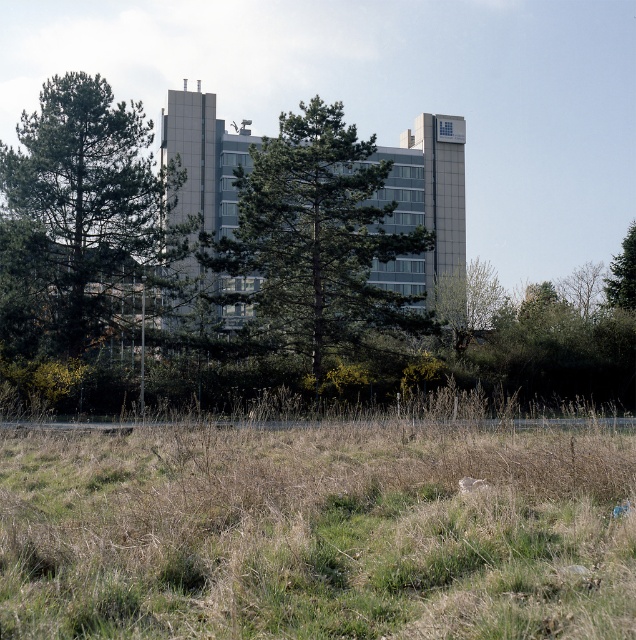
You are standing in front of the large modern building and see the green leafy tree at center and the green leafy tree at upper right. Which tree is closer to you?

The green leafy tree at center is closer to you because it is in front of the green leafy tree at upper right.